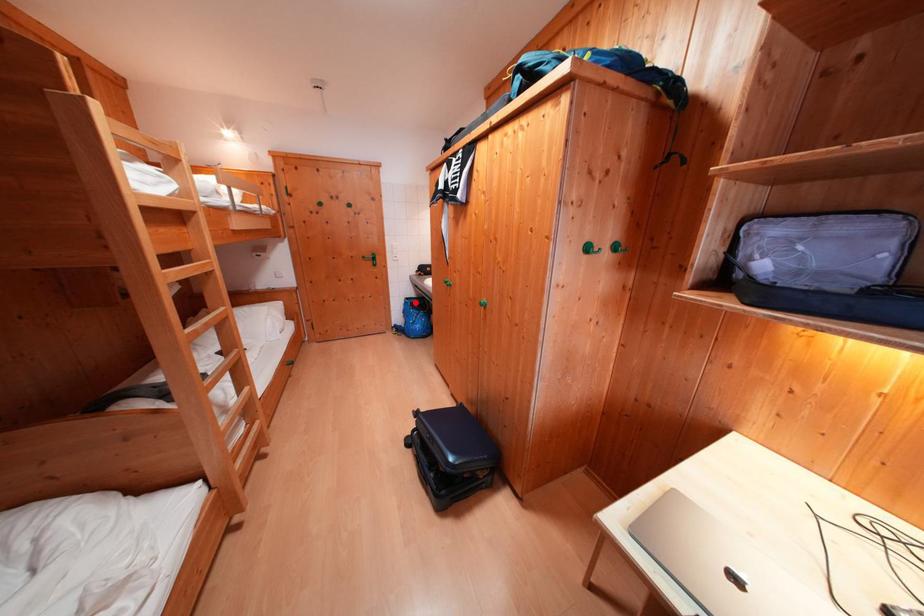
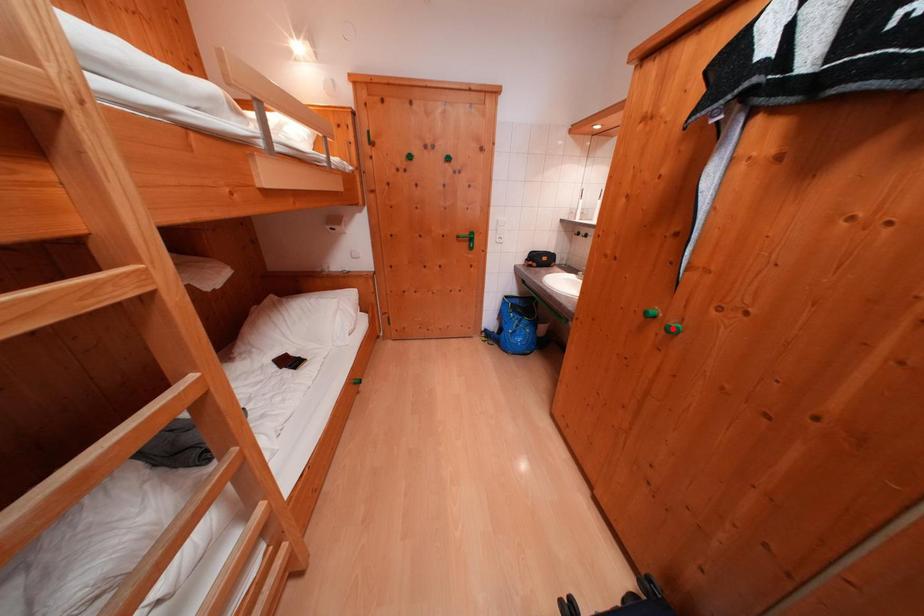
I am providing you with two images of the same scene from different viewpoints. A red point is marked on the first image and another point is marked on the second image. Are the points marked in image1 and image2 representing the same 3D position?

No